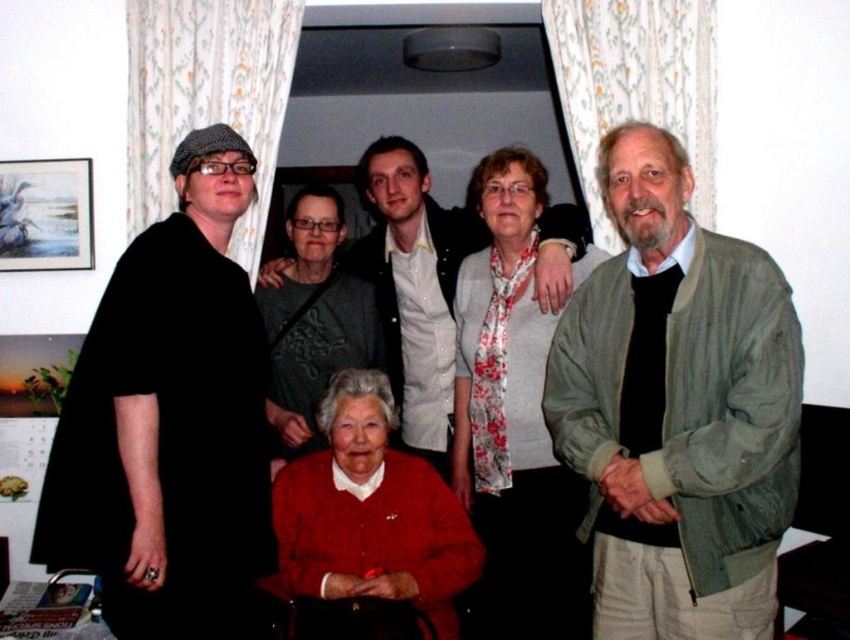
Looking at this image, is light olive-green jacket at right smaller than red knit sweater at lower center?

No.

Does light olive-green jacket at right have a lesser width compared to red knit sweater at lower center?

Indeed, light olive-green jacket at right has a lesser width compared to red knit sweater at lower center.

Measure the distance between point (632, 256) and camera.

Point (632, 256) and camera are 6.36 feet apart.

Locate an element on the screen. This screenshot has width=850, height=640. light olive-green jacket at right is located at coordinates (677, 410).

Is black matte dress at left in front of red knit sweater at lower center?

Yes.

In the scene shown: Who is higher up, black matte dress at left or red knit sweater at lower center?

black matte dress at left is above.

Is point (85, 492) positioned behind point (309, 573)?

That is False.

Find the location of a particular element. The width and height of the screenshot is (850, 640). black matte dress at left is located at coordinates (133, 412).

What are the coordinates of `light brown leather jacket at center` in the screenshot? It's located at (415, 285).